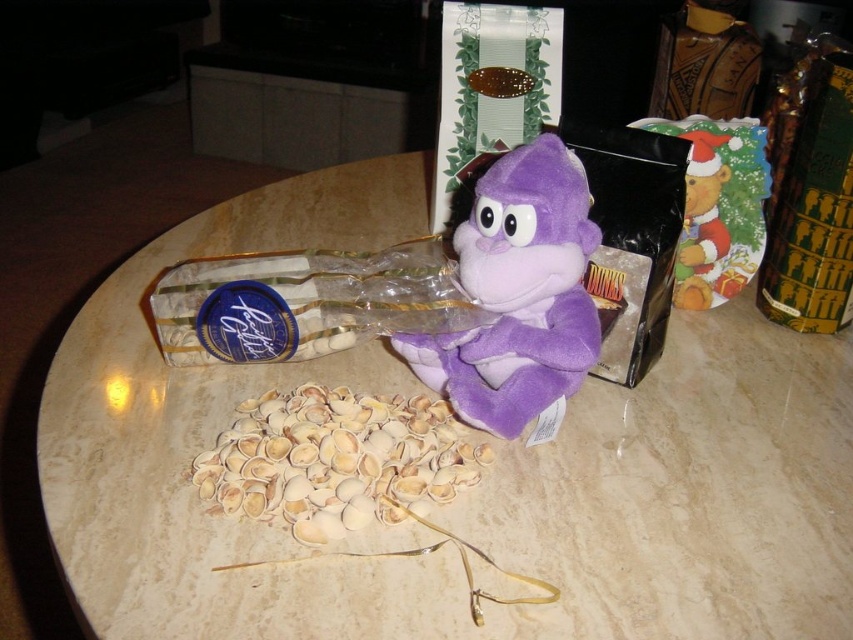
Between point (556, 192) and point (404, 445), which one is positioned behind?

Point (404, 445)

Can you confirm if purple plush monkey at center is smaller than light beige shell at center?

No, purple plush monkey at center is not smaller than light beige shell at center.

The image size is (853, 640). What are the coordinates of `purple plush monkey at center` in the screenshot? It's located at (518, 292).

Is marble table at center bigger than purple plush monkey at center?

Yes, marble table at center is bigger than purple plush monkey at center.

Describe the element at coordinates (466, 490) in the screenshot. I see `marble table at center` at that location.

Which is behind, point (86, 468) or point (548, 264)?

Positioned behind is point (548, 264).

Identify the location of marble table at center. (466, 490).

Does marble table at center have a lesser height compared to light beige shell at center?

Incorrect, marble table at center's height does not fall short of light beige shell at center's.

Between point (177, 502) and point (248, 400), which one is positioned behind?

Point (248, 400)

Measure the distance between point (338, 381) and camera.

Point (338, 381) and camera are 33.13 inches apart from each other.

Where is `marble table at center`? The height and width of the screenshot is (640, 853). marble table at center is located at coordinates (466, 490).